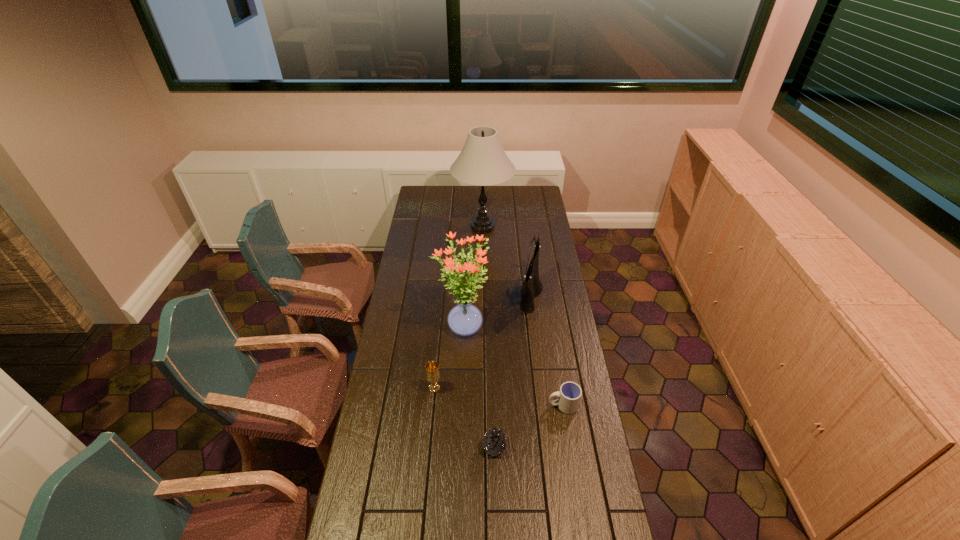
Where is `the tallest object`? Image resolution: width=960 pixels, height=540 pixels. the tallest object is located at coordinates (482, 162).

The image size is (960, 540). Find the location of `lamp`. lamp is located at coordinates [482, 162].

At what (x,y) coordinates should I click in order to perform the action: click on the fifth shortest object. Please return your answer as a coordinate pair (x, y). This screenshot has width=960, height=540. Looking at the image, I should click on (465, 319).

Locate an element on the screen. The image size is (960, 540). shoulder bag is located at coordinates (530, 289).

Where is `chalice`? This screenshot has height=540, width=960. chalice is located at coordinates (432, 369).

The image size is (960, 540). What are the coordinates of `the third shortest object` in the screenshot? It's located at (432, 369).

Image resolution: width=960 pixels, height=540 pixels. I want to click on pinecone, so click(495, 442).

I want to click on the second nearest object, so click(x=569, y=396).

Find the location of a particular element. vacant region located on the back of the farthest object is located at coordinates (482, 197).

Identify the location of free location located on the right of the flower arrangement. (530, 328).